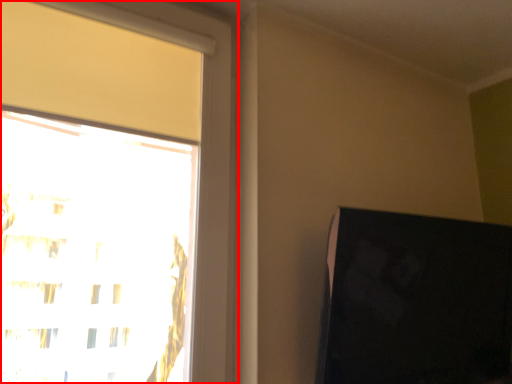
Question: From the image, what is the correct spatial relationship of window (annotated by the red box) in relation to computer monitor?

Choices:
 (A) right
 (B) left

Answer: (B)